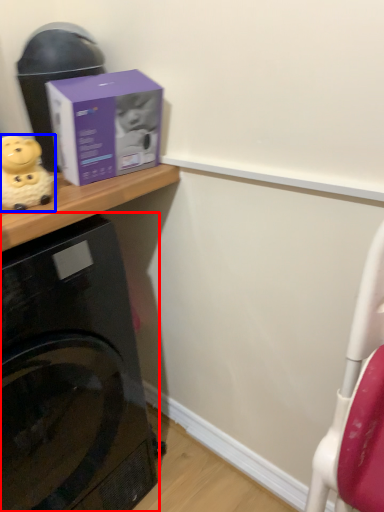
Question: Which point is further to the camera, home appliance (highlighted by a red box) or toy (highlighted by a blue box)?

Choices:
 (A) home appliance
 (B) toy

Answer: (B)